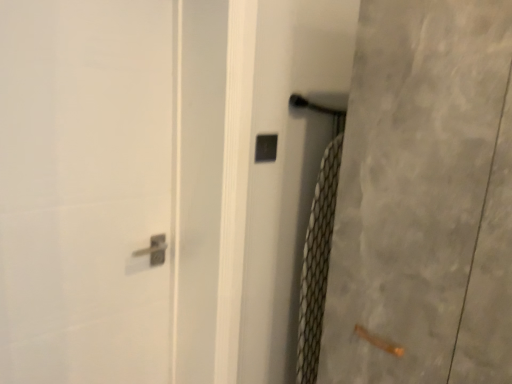
Question: From their relative heights in the image, would you say white textured screen door at right, acting as the 3th screen door starting from the left, is taller or shorter than white glossy door handle at upper center, which is counted as the third screen door, starting from the right?

Choices:
 (A) short
 (B) tall

Answer: (A)

Question: Choose the correct answer: Is white textured screen door at right, the first screen door when ordered from right to left, inside white glossy door handle at upper center, arranged as the first screen door when viewed from the left, or outside it?

Choices:
 (A) inside
 (B) outside

Answer: (B)

Question: Considering the real-world distances, which object is closest to the clear plastic screen door at center, the 2th screen door when ordered from left to right?

Choices:
 (A) black plastic lock at center
 (B) white glossy door handle at upper center, which is counted as the third screen door, starting from the right
 (C) white textured screen door at right, the first screen door when ordered from right to left

Answer: (A)

Question: Estimate the real-world distances between objects in this image. Which object is closer to the white textured screen door at right, acting as the 3th screen door starting from the left?

Choices:
 (A) white glossy door handle at upper center, which is counted as the third screen door, starting from the right
 (B) black plastic lock at center
 (C) clear plastic screen door at center, the 2th screen door from the right

Answer: (C)